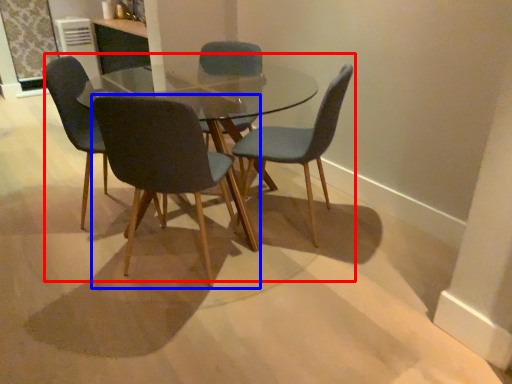
Question: Which point is further to the camera, kitchen & dining room table (highlighted by a red box) or chair (highlighted by a blue box)?

Choices:
 (A) kitchen & dining room table
 (B) chair

Answer: (A)